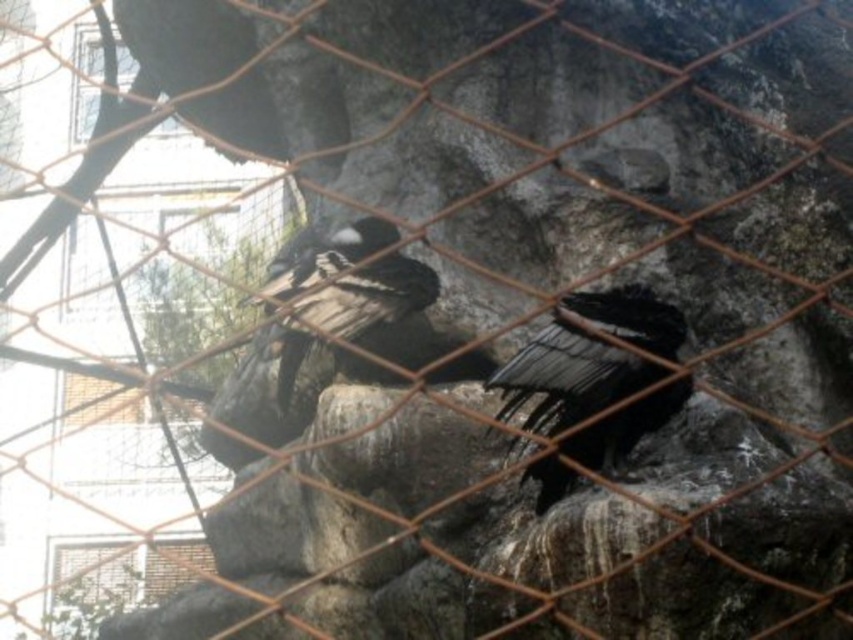
Is point (635, 289) in front of point (422, 284)?

Yes, it is.

Looking at this image, does black feathered bird at center have a lesser height compared to shiny black feathers at center?

Yes.

Locate an element on the screen. The width and height of the screenshot is (853, 640). black feathered bird at center is located at coordinates (569, 376).